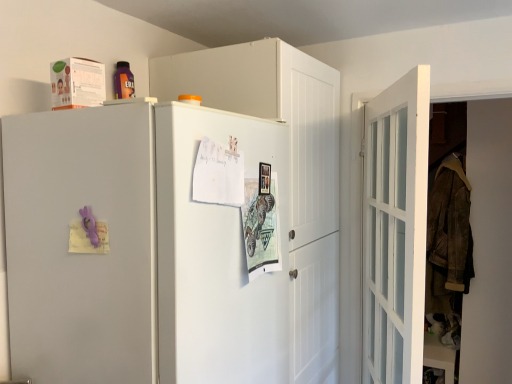
Question: Can you see white matte cabinet at upper center touching white matte refrigerator at upper left?

Choices:
 (A) no
 (B) yes

Answer: (A)

Question: Are white matte cabinet at upper center and white matte refrigerator at upper left located far from each other?

Choices:
 (A) yes
 (B) no

Answer: (B)

Question: Is the position of white matte cabinet at upper center less distant than that of white matte refrigerator at upper left?

Choices:
 (A) yes
 (B) no

Answer: (B)

Question: Does white matte cabinet at upper center have a lesser width compared to white matte refrigerator at upper left?

Choices:
 (A) yes
 (B) no

Answer: (A)

Question: Is white matte cabinet at upper center wider than white matte refrigerator at upper left?

Choices:
 (A) yes
 (B) no

Answer: (B)

Question: Is white matte cabinet at upper center looking in the opposite direction of white matte refrigerator at upper left?

Choices:
 (A) no
 (B) yes

Answer: (A)

Question: Considering the relative sizes of white matte cabinet at upper center and white glossy door at right in the image provided, is white matte cabinet at upper center bigger than white glossy door at right?

Choices:
 (A) no
 (B) yes

Answer: (B)

Question: Is white matte cabinet at upper center thinner than white glossy door at right?

Choices:
 (A) no
 (B) yes

Answer: (A)

Question: Is white matte cabinet at upper center positioned behind white glossy door at right?

Choices:
 (A) no
 (B) yes

Answer: (B)

Question: From the image's perspective, is white matte cabinet at upper center located beneath white glossy door at right?

Choices:
 (A) no
 (B) yes

Answer: (A)

Question: Does white matte cabinet at upper center contain white glossy door at right?

Choices:
 (A) yes
 (B) no

Answer: (B)

Question: Is white matte cabinet at upper center wider than white glossy door at right?

Choices:
 (A) yes
 (B) no

Answer: (A)

Question: Is white glossy door at right to the right of white matte refrigerator at upper left from the viewer's perspective?

Choices:
 (A) yes
 (B) no

Answer: (A)